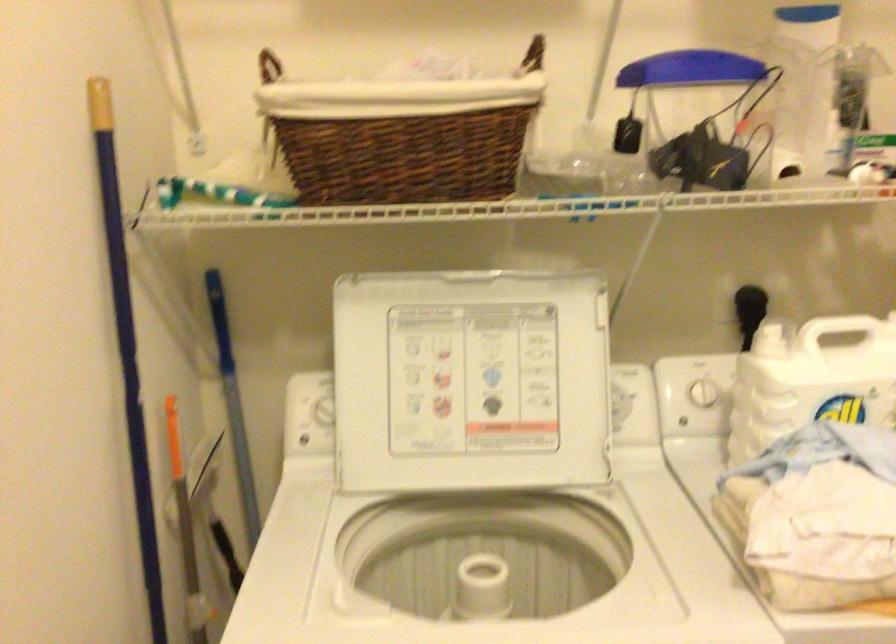
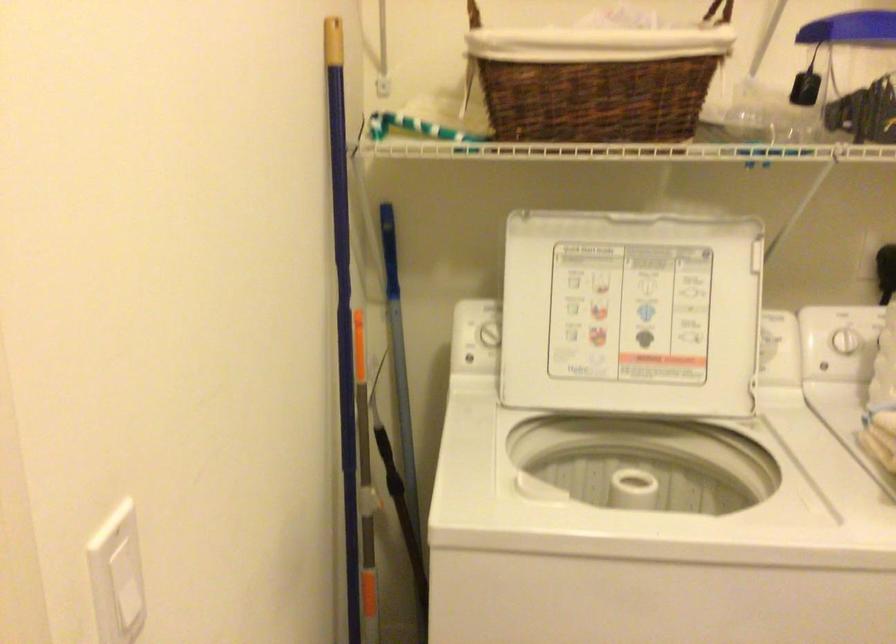
In the second image, find the point that corresponds to point 242,462 in the first image.

(400, 379)